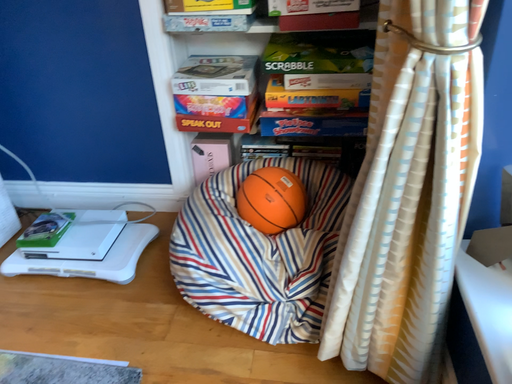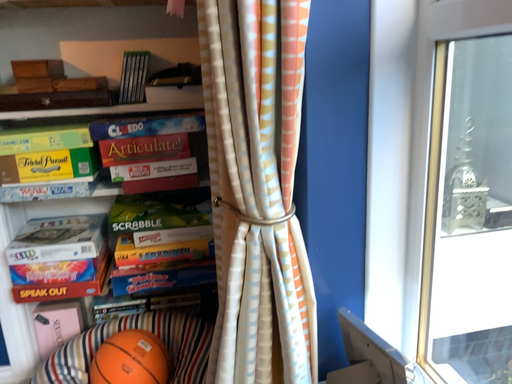
Question: How did the camera likely rotate when shooting the video?

Choices:
 (A) rotated right
 (B) rotated left

Answer: (A)